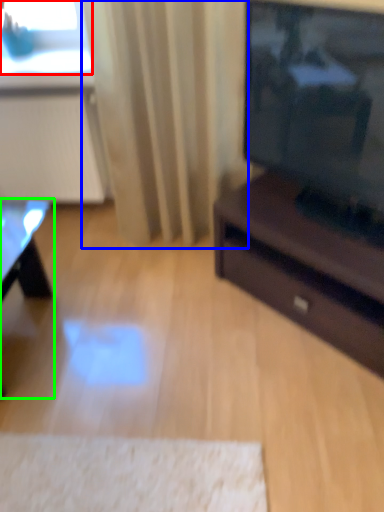
Question: Which is farther away from window screen (highlighted by a red box)? curtain (highlighted by a blue box) or table (highlighted by a green box)?

Choices:
 (A) curtain
 (B) table

Answer: (B)